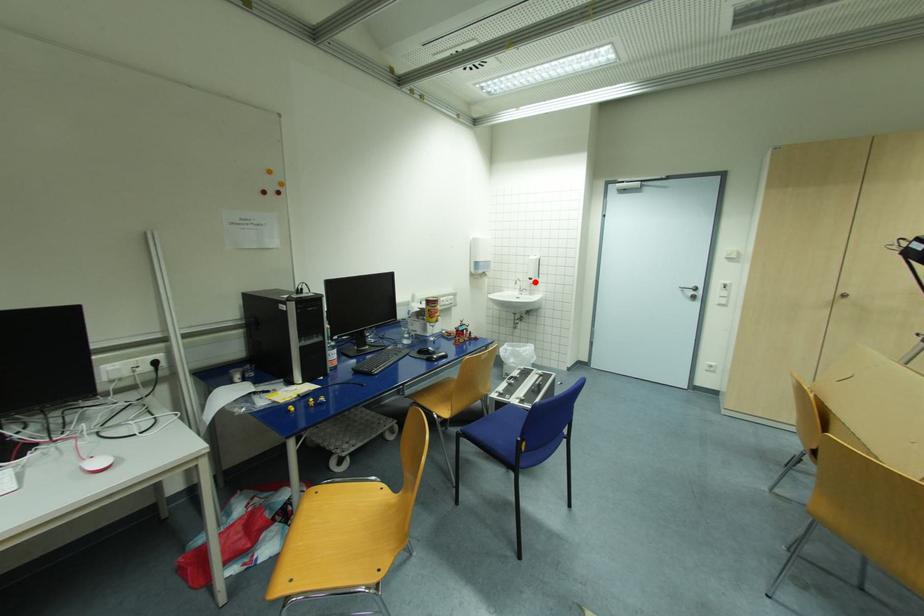
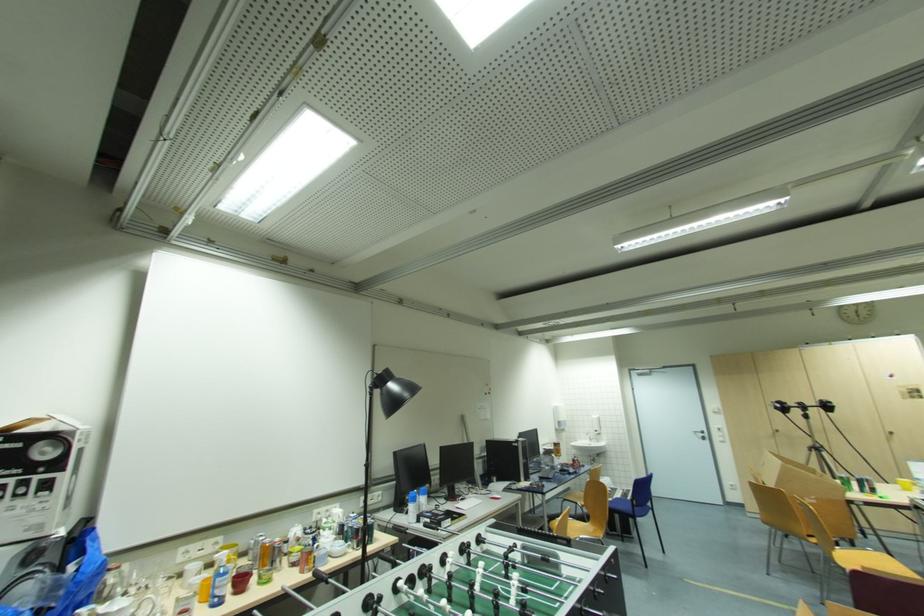
In the second image, find the point that corresponds to the highlighted location in the first image.

(601, 434)